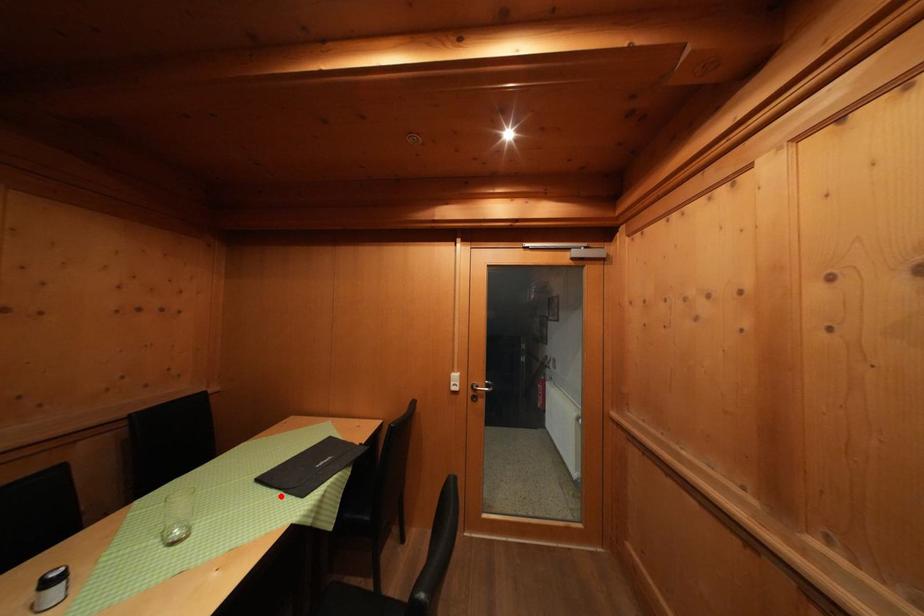
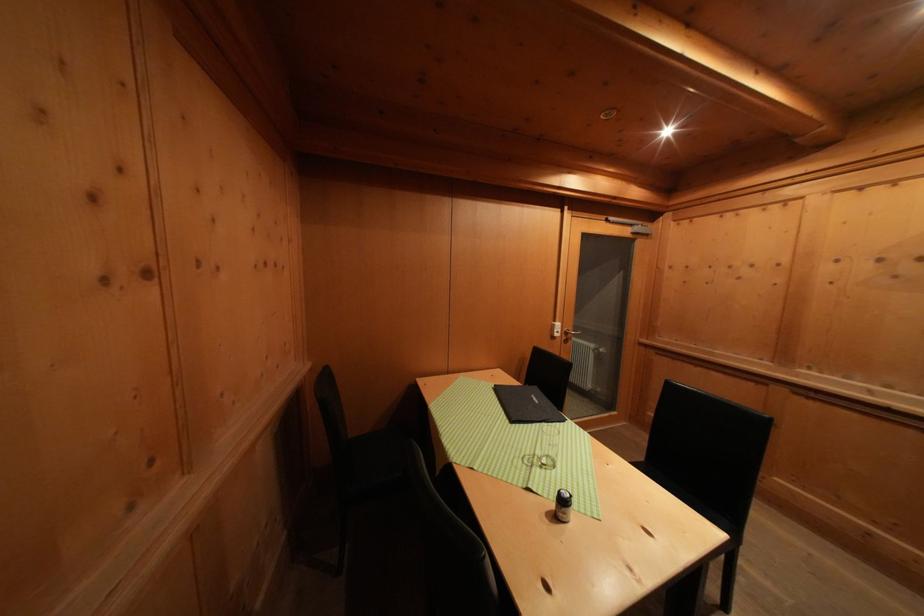
Locate, in the second image, the point that corresponds to the highlighted location in the first image.

(543, 429)